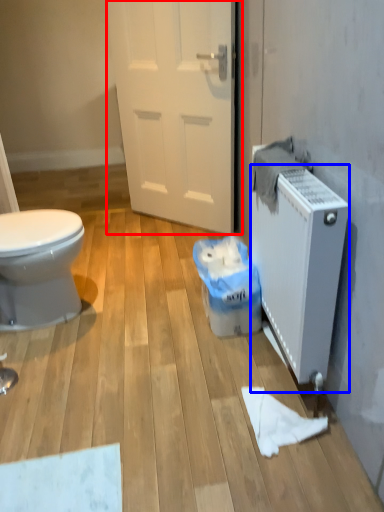
Question: Among these objects, which one is nearest to the camera, door (highlighted by a red box) or radiator (highlighted by a blue box)?

Choices:
 (A) door
 (B) radiator

Answer: (B)